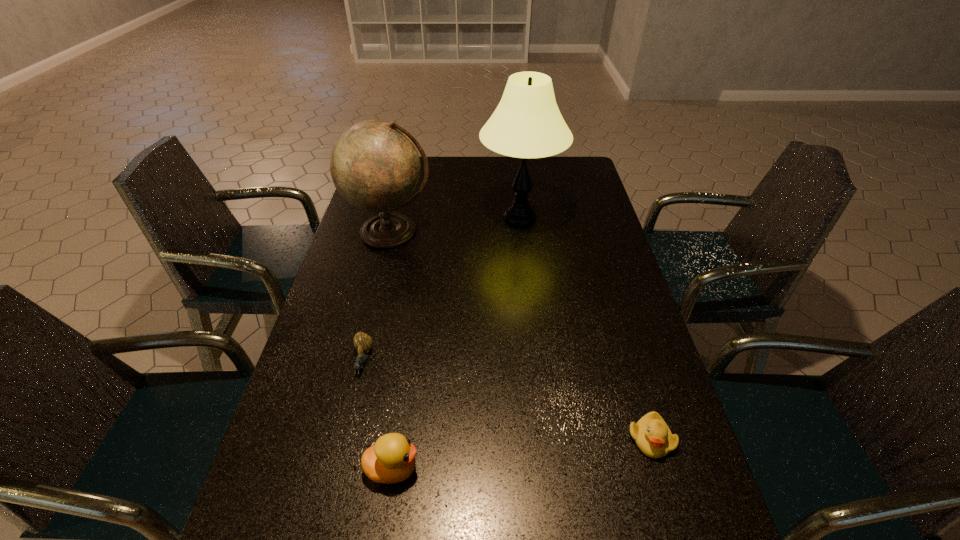
Where is `vacant space located 0.330m on the face of the taller duckling`? The height and width of the screenshot is (540, 960). vacant space located 0.330m on the face of the taller duckling is located at coordinates (582, 469).

Where is `free point located 0.110m at the face of the rightmost object`? The height and width of the screenshot is (540, 960). free point located 0.110m at the face of the rightmost object is located at coordinates pos(674,517).

Image resolution: width=960 pixels, height=540 pixels. Identify the location of blank space located 0.170m on the front-facing side of the third nearest object. (342, 448).

Find the location of a particular element. globe located at the left edge is located at coordinates (375, 166).

You are a GUI agent. You are given a task and a screenshot of the screen. Output one action in this format:
    pyautogui.click(x=<x>, y=<y>)
    Task: Click on the escargot that is at the left edge
    Image resolution: width=960 pixels, height=540 pixels.
    Given the screenshot: What is the action you would take?
    pyautogui.click(x=362, y=342)

Image resolution: width=960 pixels, height=540 pixels. Find the location of `lamp present at the right edge`. lamp present at the right edge is located at coordinates (527, 123).

Image resolution: width=960 pixels, height=540 pixels. Find the location of `duckling positioned at the right edge`. duckling positioned at the right edge is located at coordinates (652, 435).

This screenshot has width=960, height=540. Find the location of `vacant space at the far edge of the desktop`. vacant space at the far edge of the desktop is located at coordinates (495, 163).

The height and width of the screenshot is (540, 960). In order to click on vacant space at the left edge of the desktop in this screenshot , I will do `click(319, 502)`.

In the image, there is a desktop. In order to click on vacant space at the right edge in this screenshot , I will do `click(657, 364)`.